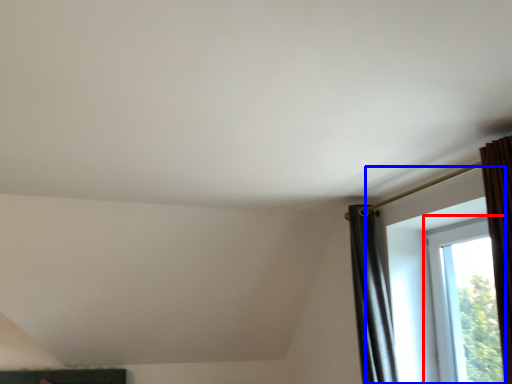
Question: Among these objects, which one is nearest to the camera, window (highlighted by a red box) or window (highlighted by a blue box)?

Choices:
 (A) window
 (B) window

Answer: (B)